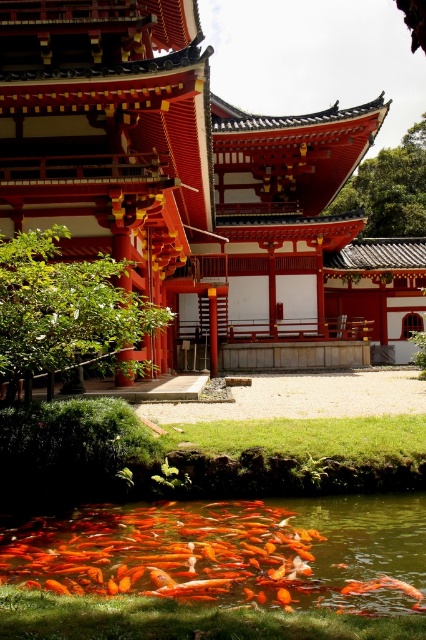
You are standing at the entrance of the temple and see the shiny orange fish at lower center represented by point (229, 552). If you want to reach this point, which direction should you walk from your current position?

The shiny orange fish at lower center is located at point (229, 552), which is in the lower center of the image. Since you are at the entrance of the temple, you should walk forward towards the center of the temple to reach the fish.

You are a visitor standing on the grassy area near the smooth red wood temple at center and want to take a photo of the orange glossy fish at lower center. Will the temple block your view of the fish?

The smooth red wood temple at center is much taller than the orange glossy fish at lower center, so the temple may block your view of the fish depending on your position.

You are standing at the edge of the pond in the temple courtyard and notice two fish swimming near you. The first is a shiny orange fish at lower center, and the second is an orange glossy fish at lower center. If you want to feed both fish, which one is closer to your current position?

The shiny orange fish at lower center is closer to your current position since it is only 4.92 feet away from the orange glossy fish at lower center, meaning it is nearer to the edge where you are standing.